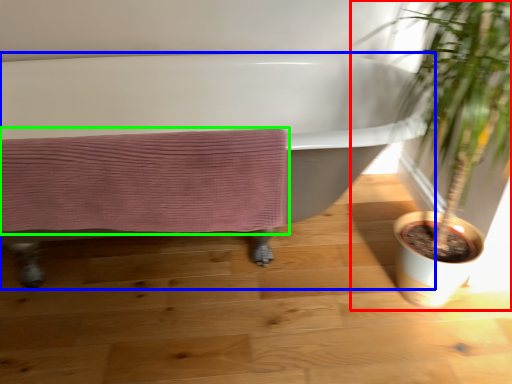
Question: Considering the real-world distances, which object is farthest from houseplant (highlighted by a red box)? bathtub (highlighted by a blue box) or bath towel (highlighted by a green box)?

Choices:
 (A) bathtub
 (B) bath towel

Answer: (A)